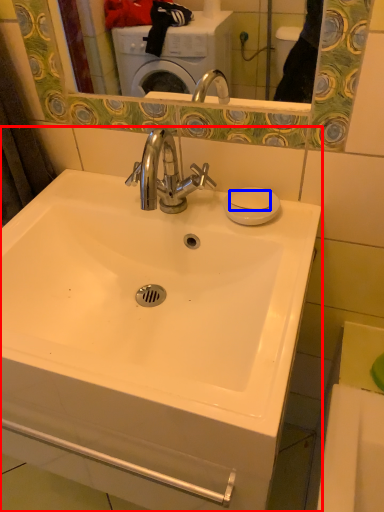
Question: Which object appears closest to the camera in this image, sink (highlighted by a red box) or soap (highlighted by a blue box)?

Choices:
 (A) sink
 (B) soap

Answer: (A)